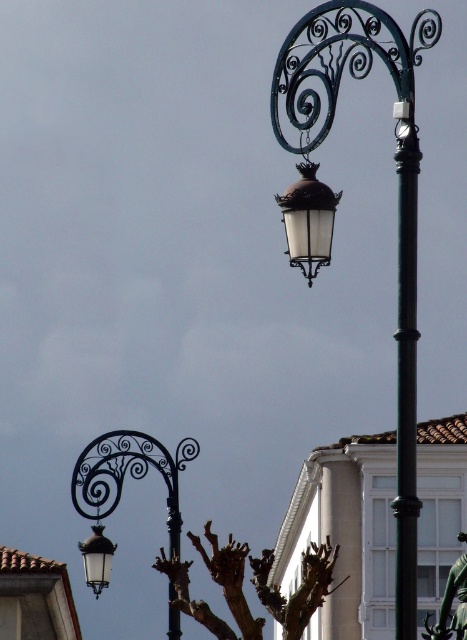
Question: Which object appears farthest from the camera in this image?

Choices:
 (A) matte black street light at upper right
 (B) black metal pole at upper right

Answer: (A)

Question: Which point appears farthest from the camera in this image?

Choices:
 (A) click(169, 625)
 (B) click(79, 547)
 (C) click(295, 628)
 (D) click(404, 557)

Answer: (B)

Question: Which point is closer to the camera taking this photo?

Choices:
 (A) (457, 621)
 (B) (328, 224)
 (C) (415, 490)

Answer: (C)

Question: Does bronze statue at center have a lesser width compared to matte black lantern at lower left?

Choices:
 (A) no
 (B) yes

Answer: (B)

Question: Can you confirm if matte black lamp post at upper center is positioned above bronze statue at center?

Choices:
 (A) yes
 (B) no

Answer: (B)

Question: Does black metal pole at upper right come behind bronze statue at center?

Choices:
 (A) yes
 (B) no

Answer: (B)